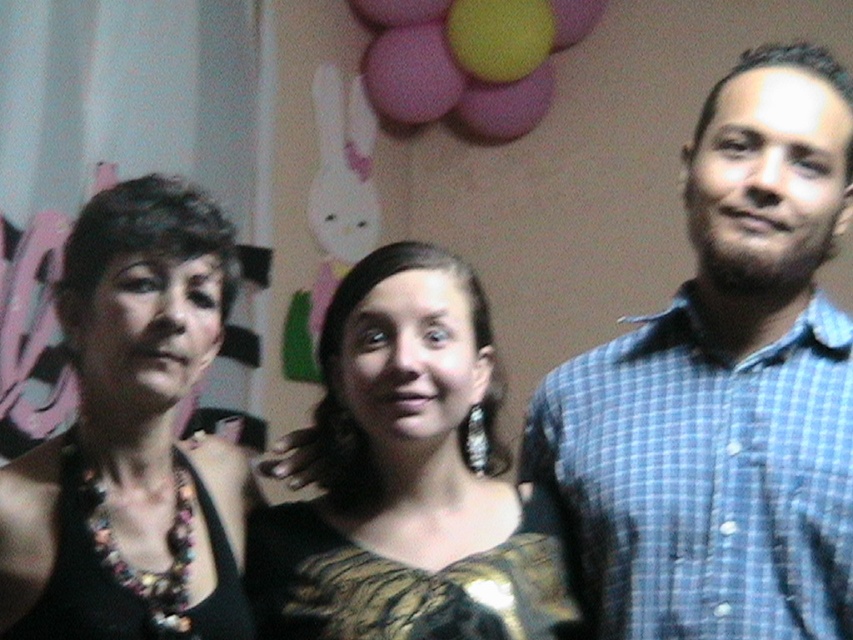
You are at a party and want to take a photo with the blue checkered shirt at right and the gold textured dress at center. If you stand to the left of both, which one should you stand closer to to include both in the frame without moving them?

You should stand closer to the gold textured dress at center because the blue checkered shirt at right is positioned to the right of the gold textured dress at center, so placing yourself closer to the center person will help keep both in the frame.